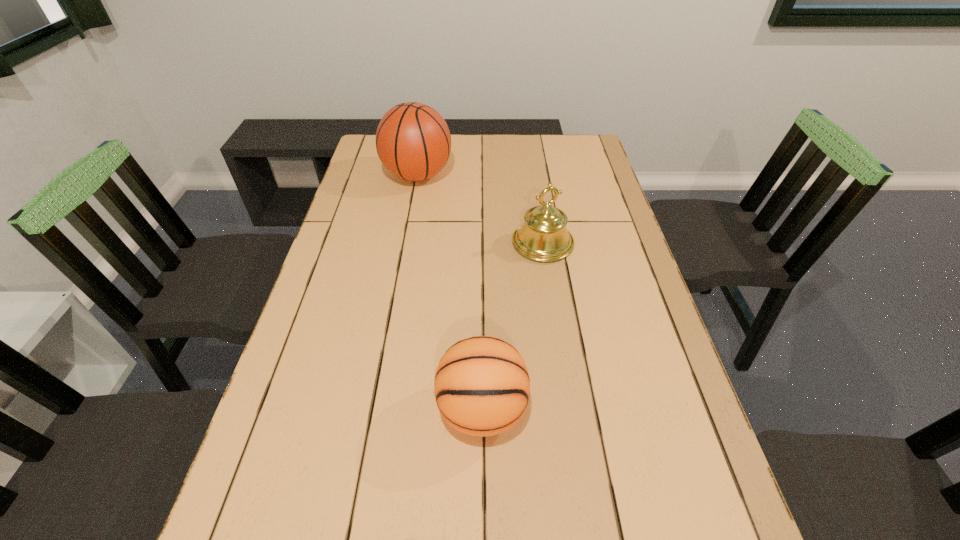
At what (x,y) coordinates should I click in order to perform the action: click on the left basketball. Please return your answer as a coordinate pair (x, y). Image resolution: width=960 pixels, height=540 pixels. Looking at the image, I should click on (413, 141).

The width and height of the screenshot is (960, 540). I want to click on the leftmost object, so click(413, 141).

Identify the location of bell. Image resolution: width=960 pixels, height=540 pixels. (543, 237).

The image size is (960, 540). In order to click on the right basketball in this screenshot , I will do `click(482, 386)`.

Find the location of a particular element. the nearer basketball is located at coordinates (482, 386).

Image resolution: width=960 pixels, height=540 pixels. I want to click on vacant position located 0.240m on the front of the left basketball, so click(x=405, y=244).

Image resolution: width=960 pixels, height=540 pixels. Find the location of `free spot located 0.150m on the front of the second farthest object`. free spot located 0.150m on the front of the second farthest object is located at coordinates (552, 305).

Find the location of a particular element. free space located 0.380m on the back of the nearest object is located at coordinates (481, 256).

Identify the location of object located at the far edge. (413, 141).

Locate an element on the screen. object at the left edge is located at coordinates (413, 141).